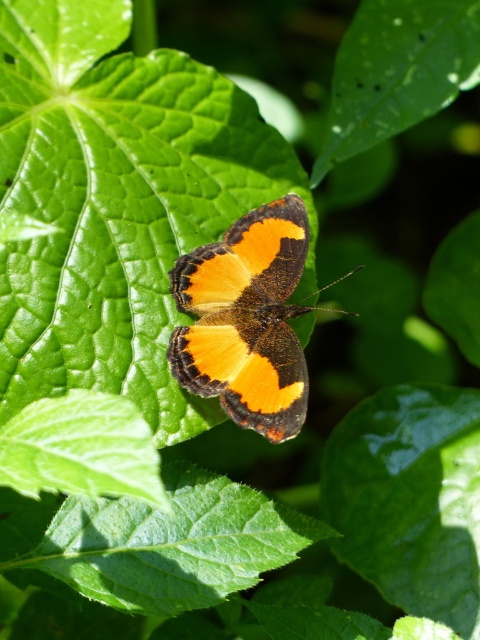
You are an entomologist observing the butterfly and its environment. You notice two leaves in the scene. Which leaf is wider, the green smooth leaf at center or the glossy green leaf at upper center?

The green smooth leaf at center is wider than the glossy green leaf at upper center according to the description.

You are an entomologist observing the butterfly in the scene. You notice a point marked at coordinates (x=158, y=541). Which object does this point correspond to?

The point at coordinates (x=158, y=541) corresponds to the green smooth leaf at center.